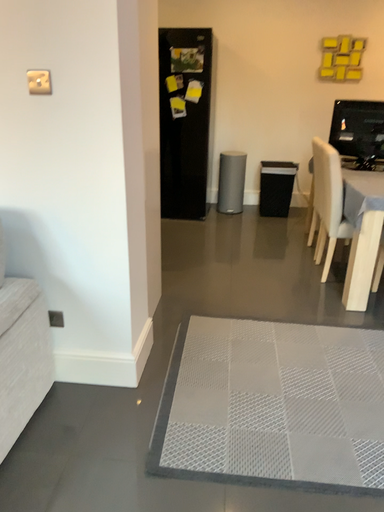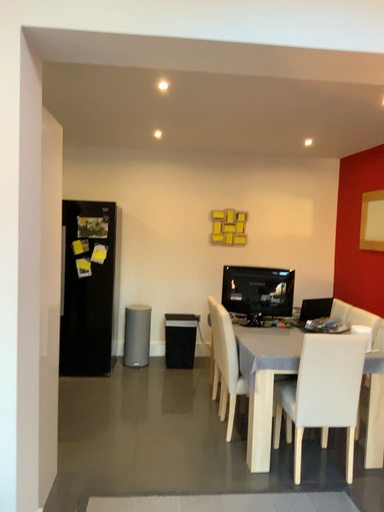
Question: How did the camera likely rotate when shooting the video?

Choices:
 (A) rotated left
 (B) rotated right

Answer: (B)